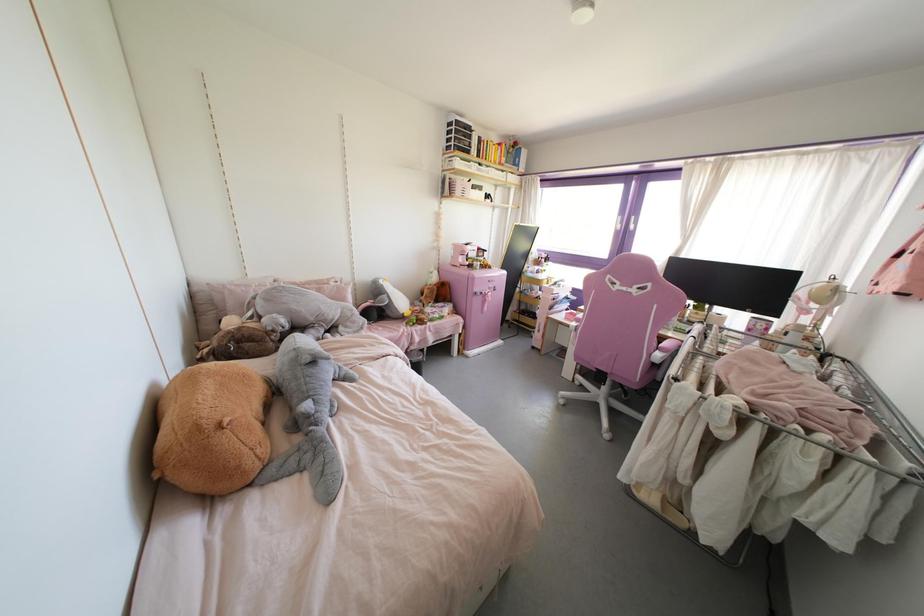
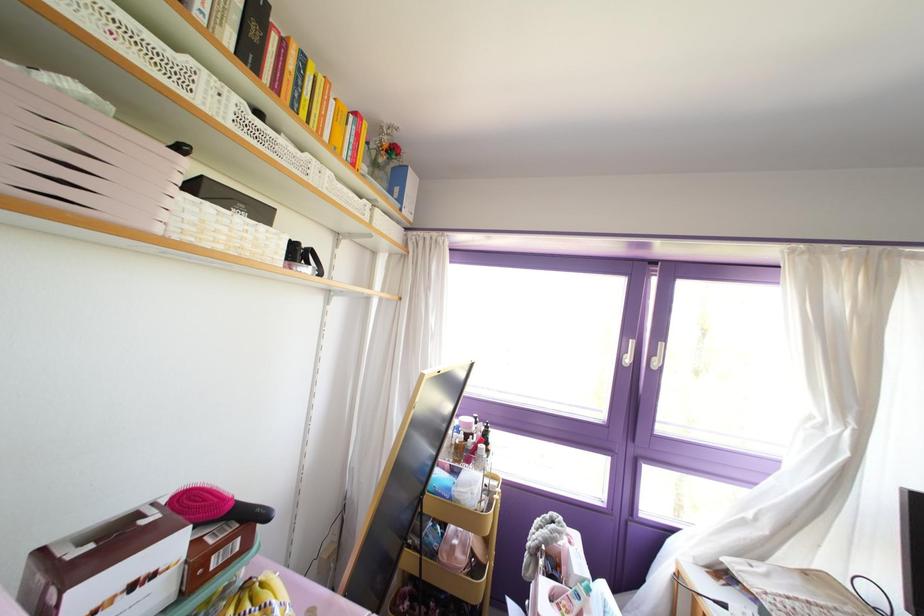
In the second image, find the point that corresponds to the point at 499,163 in the first image.

(351, 164)